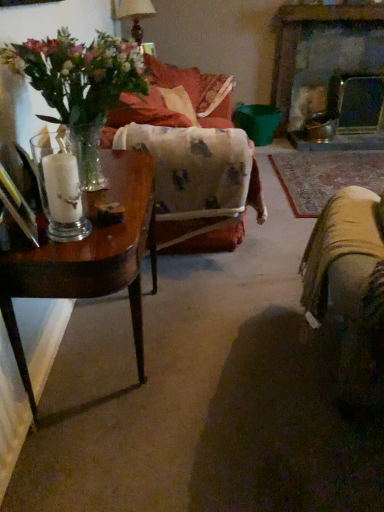
Question: From a real-world perspective, is matte white lampshade at upper center over wooden table at left?

Choices:
 (A) yes
 (B) no

Answer: (A)

Question: Can you confirm if matte white lampshade at upper center is shorter than wooden table at left?

Choices:
 (A) no
 (B) yes

Answer: (B)

Question: Is matte white lampshade at upper center bigger than wooden table at left?

Choices:
 (A) no
 (B) yes

Answer: (A)

Question: Is matte white lampshade at upper center wider than wooden table at left?

Choices:
 (A) yes
 (B) no

Answer: (B)

Question: From the image's perspective, is matte white lampshade at upper center above wooden table at left?

Choices:
 (A) yes
 (B) no

Answer: (A)

Question: Considering the relative sizes of matte white lampshade at upper center and wooden table at left in the image provided, is matte white lampshade at upper center taller than wooden table at left?

Choices:
 (A) no
 (B) yes

Answer: (A)

Question: Can we say smooth stone fireplace at upper right lies outside wooden table at left?

Choices:
 (A) yes
 (B) no

Answer: (A)

Question: Does smooth stone fireplace at upper right have a lesser height compared to wooden table at left?

Choices:
 (A) no
 (B) yes

Answer: (A)

Question: Considering the relative sizes of smooth stone fireplace at upper right and wooden table at left in the image provided, is smooth stone fireplace at upper right smaller than wooden table at left?

Choices:
 (A) yes
 (B) no

Answer: (B)

Question: Can you confirm if smooth stone fireplace at upper right is wider than wooden table at left?

Choices:
 (A) yes
 (B) no

Answer: (B)

Question: Are smooth stone fireplace at upper right and wooden table at left making contact?

Choices:
 (A) no
 (B) yes

Answer: (A)

Question: Can you confirm if smooth stone fireplace at upper right is taller than wooden table at left?

Choices:
 (A) no
 (B) yes

Answer: (B)

Question: Does clear glass candle at left have a smaller size compared to velvet orange couch at center, the 2th couch viewed from the front?

Choices:
 (A) no
 (B) yes

Answer: (B)